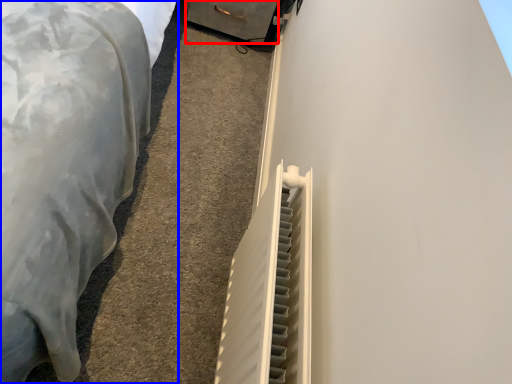
Question: Which of the following is the closest to the observer, drawer (highlighted by a red box) or furniture (highlighted by a blue box)?

Choices:
 (A) drawer
 (B) furniture

Answer: (B)